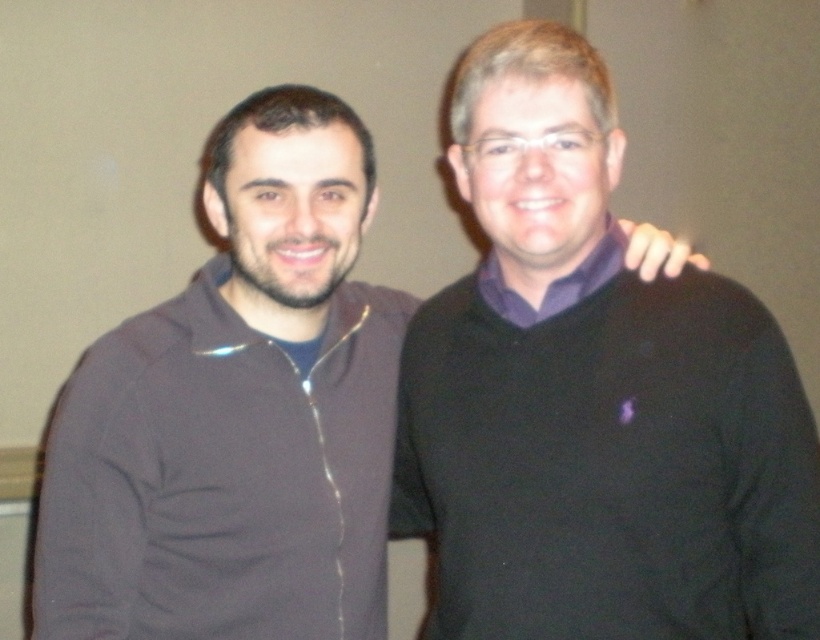
You are standing in the same room as the two people in the image. You need to place a small gift box at a position that is closer to the point labeled point (746, 310) than to point (176, 506). Which of the two points should you use as your reference to ensure the gift box is placed correctly?

To place the gift box closer to point (746, 310) than to point (176, 506), you should use point (746, 310) as your reference since it is in front of the other point, allowing for accurate placement.

You are trying to decide which sweater to wear today. You see the black sweater at center and the dark matte sweater at center in the image. Which one has a larger size?

The black sweater at center is bigger than the dark matte sweater at center, so you should choose the black sweater at center if you want a larger size.